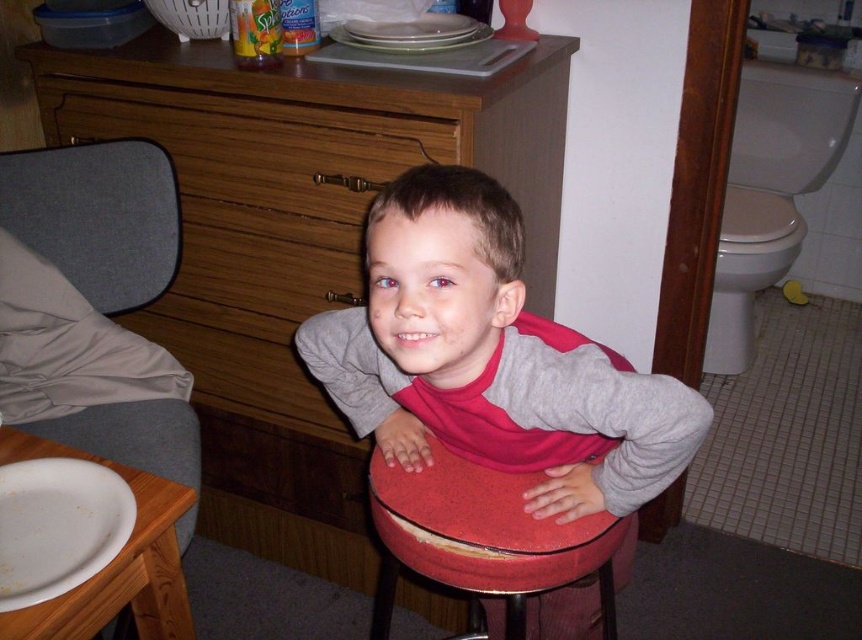
Does matte wood dresser at center have a larger size compared to gray fabric cushion at left?

Indeed, matte wood dresser at center has a larger size compared to gray fabric cushion at left.

Which is behind, point (338, 522) or point (122, 388)?

The point (338, 522) is more distant.

Identify the location of matte wood dresser at center. (295, 241).

Is matte red stool at center taller than gray fabric cushion at left?

In fact, matte red stool at center may be shorter than gray fabric cushion at left.

Does matte red stool at center have a lesser height compared to gray fabric cushion at left?

Correct, matte red stool at center is not as tall as gray fabric cushion at left.

Measure the distance between matte red stool at center and camera.

A distance of 30.62 inches exists between matte red stool at center and camera.

The image size is (862, 640). Find the location of `matte red stool at center`. matte red stool at center is located at coordinates (491, 358).

Measure the distance from matte red stool at center to red cushioned stool at center.

5.11 inches

Between point (445, 218) and point (380, 595), which one is positioned behind?

The point (380, 595) is more distant.

Who is more forward, (x=453, y=384) or (x=478, y=522)?

Point (x=453, y=384)

What are the coordinates of `matte red stool at center` in the screenshot? It's located at (491, 358).